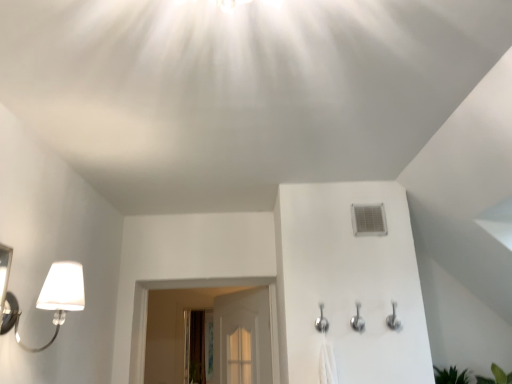
Question: Does white matte lamp at left have a greater height compared to silver metallic shower head at center?

Choices:
 (A) yes
 (B) no

Answer: (A)

Question: Is white matte lamp at left smaller than silver metallic shower head at center?

Choices:
 (A) no
 (B) yes

Answer: (A)

Question: Is white matte lamp at left facing towards silver metallic shower head at center?

Choices:
 (A) yes
 (B) no

Answer: (B)

Question: Considering the relative sizes of white matte lamp at left and silver metallic shower head at center in the image provided, is white matte lamp at left bigger than silver metallic shower head at center?

Choices:
 (A) no
 (B) yes

Answer: (B)

Question: From the image's perspective, is white matte lamp at left on silver metallic shower head at center?

Choices:
 (A) no
 (B) yes

Answer: (B)

Question: Is white matte lamp at left at the left side of silver metallic shower head at center?

Choices:
 (A) yes
 (B) no

Answer: (A)

Question: Does green leafy plant at lower right have a smaller size compared to silver metallic shower head at center?

Choices:
 (A) yes
 (B) no

Answer: (B)

Question: Does green leafy plant at lower right have a greater height compared to silver metallic shower head at center?

Choices:
 (A) no
 (B) yes

Answer: (A)

Question: From the image's perspective, is green leafy plant at lower right over silver metallic shower head at center?

Choices:
 (A) yes
 (B) no

Answer: (B)

Question: From the image's perspective, is green leafy plant at lower right below silver metallic shower head at center?

Choices:
 (A) yes
 (B) no

Answer: (A)

Question: Is green leafy plant at lower right at the left side of silver metallic shower head at center?

Choices:
 (A) yes
 (B) no

Answer: (B)

Question: From a real-world perspective, does green leafy plant at lower right sit lower than silver metallic shower head at center?

Choices:
 (A) yes
 (B) no

Answer: (A)

Question: From the image's perspective, is silver metallic shower head at center located above white matte lamp at left?

Choices:
 (A) no
 (B) yes

Answer: (A)